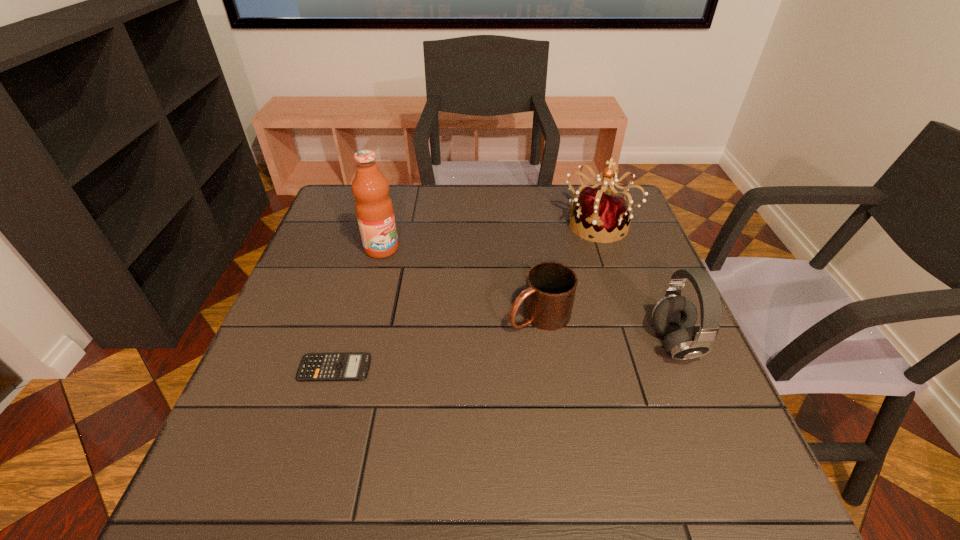
I want to click on free space located on the front-facing side of the tiara, so click(x=552, y=300).

You are a GUI agent. You are given a task and a screenshot of the screen. Output one action in this format:
    pyautogui.click(x=<x>, y=<y>)
    Task: Click on the vacant space located on the front-facing side of the tiara
    This screenshot has height=540, width=960.
    Given the screenshot: What is the action you would take?
    pyautogui.click(x=572, y=266)

Identify the location of free point located 0.400m on the front-facing side of the tiara. (529, 340).

Identify the location of free space located on the side of the third object from right to left with the handle. The height and width of the screenshot is (540, 960). (444, 364).

Identify the location of free location located on the side of the third object from right to left with the handle. (492, 339).

Identify the location of vacant space situated 0.230m on the side of the third object from right to left with the handle. The image size is (960, 540). (424, 376).

Identify the location of vacant space located on the front label of the tallest object. (490, 327).

Locate an element on the screen. The width and height of the screenshot is (960, 540). free space located on the front label of the tallest object is located at coordinates (466, 309).

Locate an element on the screen. The height and width of the screenshot is (540, 960). free point located on the front label of the tallest object is located at coordinates (474, 316).

I want to click on object that is at the far edge, so click(x=600, y=210).